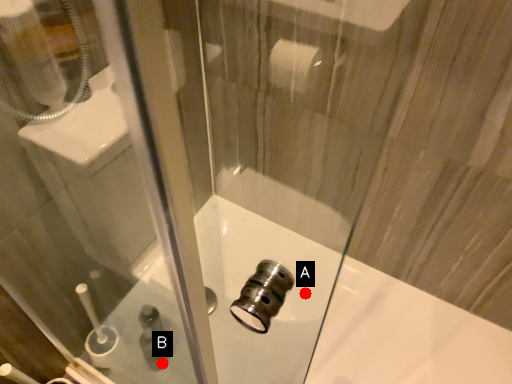
Question: Two points are circled on the image, labeled by A and B beside each circle. Which of the following is the closest to the observer?

Choices:
 (A) A is closer
 (B) B is closer

Answer: (A)